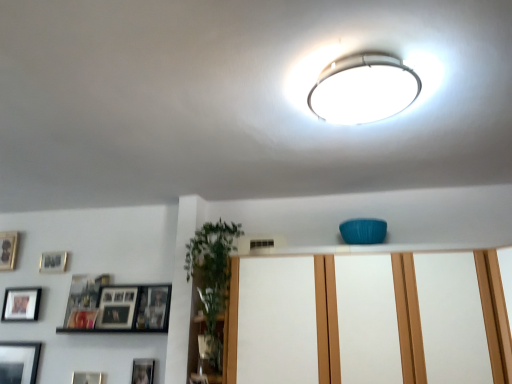
What is the approximate height of wooden photo frame at left, which ranks as the sixth picture frame in right-to-left order?

The height of wooden photo frame at left, which ranks as the sixth picture frame in right-to-left order, is 22.86 centimeters.

What do you see at coordinates (53, 262) in the screenshot?
I see `matte silver picture frame at upper left, the fifth picture frame positioned from the bottom` at bounding box center [53, 262].

Measure the distance between point (430, 313) and camera.

Point (430, 313) and camera are 5.21 feet apart from each other.

You are a GUI agent. You are given a task and a screenshot of the screen. Output one action in this format:
    pyautogui.click(x=<x>, y=<y>)
    Task: Click on the matte black picture frame at lower left, which appears as the second picture frame when viewed from the left
    This screenshot has width=512, height=384.
    Given the screenshot: What is the action you would take?
    pyautogui.click(x=21, y=304)

What is the approximate width of wooden photo frame at lower center, which is the first picture frame in right-to-left order?

wooden photo frame at lower center, which is the first picture frame in right-to-left order, is 1.82 centimeters wide.

Describe the element at coordinates (83, 300) in the screenshot. I see `matte black picture frame at upper left, which is the 3th picture frame in top-to-bottom order` at that location.

Identify the location of wooden photo frame at left, placed as the 1th picture frame when sorted from left to right. This screenshot has width=512, height=384. (8, 250).

In the image, is wooden photo frame at lower center, arranged as the sixth picture frame when viewed from the left, on the left side or the right side of matte white dresser at center?

Clearly, wooden photo frame at lower center, arranged as the sixth picture frame when viewed from the left, is on the left of matte white dresser at center in the image.

Who is smaller, wooden photo frame at lower center, arranged as the sixth picture frame when viewed from the left, or matte white dresser at center?

wooden photo frame at lower center, arranged as the sixth picture frame when viewed from the left, is smaller.

Does point (139, 373) appear closer or farther from the camera than point (357, 307)?

Clearly, point (139, 373) is more distant from the camera than point (357, 307).

Is matte black picture frame at lower left, which is counted as the fifth picture frame, starting from the right, turned away from matte silver picture frame at upper left, the fifth picture frame positioned from the bottom?

No.

Considering the relative positions of matte black picture frame at lower left, which appears as the second picture frame when viewed from the left, and matte silver picture frame at upper left, the fourth picture frame positioned from the right, in the image provided, is matte black picture frame at lower left, which appears as the second picture frame when viewed from the left, behind matte silver picture frame at upper left, the fourth picture frame positioned from the right,?

No, the depth of matte black picture frame at lower left, which appears as the second picture frame when viewed from the left, is less than that of matte silver picture frame at upper left, the fourth picture frame positioned from the right.

Identify the location of picture frame that is the 1st one when counting rightward from the matte black picture frame at lower left, which is the 4th picture frame in top-to-bottom order. This screenshot has height=384, width=512. (53, 262).

From a real-world perspective, is matte white dresser at center physically below white glossy ceiling light at upper center?

Yes.

Considering the sizes of matte white dresser at center and white glossy ceiling light at upper center in the image, is matte white dresser at center wider or thinner than white glossy ceiling light at upper center?

In the image, matte white dresser at center appears to be wider than white glossy ceiling light at upper center.

Measure the distance between matte white dresser at center and white glossy ceiling light at upper center.

matte white dresser at center is 32.53 inches from white glossy ceiling light at upper center.

Is matte white dresser at center shorter than white glossy ceiling light at upper center?

Incorrect, the height of matte white dresser at center does not fall short of that of white glossy ceiling light at upper center.

Is matte white dresser at center wider than matte black picture frame at lower left, the 3th picture frame positioned from the bottom?

Yes.

Looking at this image, can you see matte white dresser at center touching matte black picture frame at lower left, the 3th picture frame positioned from the bottom?

No.

Does point (229, 354) lie behind point (20, 311)?

No, (229, 354) is closer to viewer.

Is white glossy ceiling light at upper center facing away from wooden photo frame at left, positioned as the 1th picture frame in top-to-bottom order?

No, white glossy ceiling light at upper center is not facing the opposite direction of wooden photo frame at left, positioned as the 1th picture frame in top-to-bottom order.

Consider the image. Does white glossy ceiling light at upper center contain wooden photo frame at left, placed as the 1th picture frame when sorted from left to right?

No, wooden photo frame at left, placed as the 1th picture frame when sorted from left to right, is not a part of white glossy ceiling light at upper center.

Is white glossy ceiling light at upper center further to camera compared to wooden photo frame at left, which ranks as the sixth picture frame in right-to-left order?

No, white glossy ceiling light at upper center is closer to the viewer.

In terms of height, does white glossy ceiling light at upper center look taller or shorter compared to wooden photo frame at left, placed as the 1th picture frame when sorted from left to right?

Considering their sizes, white glossy ceiling light at upper center has less height than wooden photo frame at left, placed as the 1th picture frame when sorted from left to right.

Is point (42, 271) positioned after point (400, 329)?

Yes.

From a real-world perspective, which is physically below, matte silver picture frame at upper left, the fourth picture frame positioned from the right, or matte white dresser at center?

matte white dresser at center is physically lower.

What's the angular difference between matte silver picture frame at upper left, which ranks as the 2th picture frame in top-to-bottom order, and matte white dresser at center's facing directions?

They differ by 0.427 degrees in their facing directions.

Is matte white dresser at center at the back of matte silver picture frame at upper left, the fifth picture frame positioned from the bottom?

No, matte silver picture frame at upper left, the fifth picture frame positioned from the bottom, is not facing away from matte white dresser at center.

What's the angular difference between matte silver picture frame at upper left, placed as the 3th picture frame when sorted from left to right, and matte black picture frame at lower left, the 3th picture frame positioned from the bottom,'s facing directions?

The angle between the facing direction of matte silver picture frame at upper left, placed as the 3th picture frame when sorted from left to right, and the facing direction of matte black picture frame at lower left, the 3th picture frame positioned from the bottom, is 0.00536 degrees.

Can we say matte silver picture frame at upper left, placed as the 3th picture frame when sorted from left to right, lies outside matte black picture frame at lower left, which is the 4th picture frame in top-to-bottom order?

Yes.

How far apart are matte silver picture frame at upper left, the fourth picture frame positioned from the right, and matte black picture frame at lower left, which is the 4th picture frame in top-to-bottom order?

They are 19.06 centimeters apart.

Considering the sizes of matte silver picture frame at upper left, placed as the 3th picture frame when sorted from left to right, and matte black picture frame at lower left, which appears as the second picture frame when viewed from the left, in the image, is matte silver picture frame at upper left, placed as the 3th picture frame when sorted from left to right, bigger or smaller than matte black picture frame at lower left, which appears as the second picture frame when viewed from the left,?

Clearly, matte silver picture frame at upper left, placed as the 3th picture frame when sorted from left to right, is smaller in size than matte black picture frame at lower left, which appears as the second picture frame when viewed from the left.

Identify the location of the 1st picture frame behind the matte white dresser at center, starting your count from the anchor. The width and height of the screenshot is (512, 384). (143, 371).

From a real-world perspective, starting from the matte black picture frame at lower left, which is the 4th picture frame in top-to-bottom order, which picture frame is the 2nd one vertically above it? Please provide its 2D coordinates.

[(53, 262)]

Looking at this image, estimate the real-world distances between objects in this image. Which object is closer to matte black picture frame at lower left, positioned as the 6th picture frame in top-to-bottom order, matte black picture frame at upper left, the third picture frame viewed from the right, or wooden photo frame at left, the 6th picture frame ordered from the bottom?

matte black picture frame at upper left, the third picture frame viewed from the right, is positioned closer to the anchor matte black picture frame at lower left, positioned as the 6th picture frame in top-to-bottom order.

Based on their spatial positions, is matte silver picture frame at upper left, the fourth picture frame positioned from the right, or matte black picture frame at lower left, which is counted as the fifth picture frame, starting from the right, further from wooden photo frame at lower center, which is counted as the 2th picture frame, starting from the bottom?

matte silver picture frame at upper left, the fourth picture frame positioned from the right.

When comparing their distances from matte white dresser at center, does matte silver picture frame at upper left, placed as the 3th picture frame when sorted from left to right, or matte black picture frame at lower left, which is counted as the fifth picture frame, starting from the right, seem closer?

Among the two, matte silver picture frame at upper left, placed as the 3th picture frame when sorted from left to right, is located nearer to matte white dresser at center.

Which object lies nearer to the anchor point matte white dresser at center, matte silver picture frame at upper left, the fourth picture frame positioned from the right, or wooden photo frame at lower center, arranged as the sixth picture frame when viewed from the left?

The object closer to matte white dresser at center is wooden photo frame at lower center, arranged as the sixth picture frame when viewed from the left.

Based on their spatial positions, is matte white dresser at center or matte black picture frame at upper left, which is the 3th picture frame in top-to-bottom order, further from matte silver picture frame at upper left, the fifth picture frame positioned from the bottom?

matte white dresser at center is further to matte silver picture frame at upper left, the fifth picture frame positioned from the bottom.

Based on their spatial positions, is matte white dresser at center or matte black picture frame at lower left, which appears as the second picture frame when viewed from the left, further from wooden photo frame at lower center, arranged as the sixth picture frame when viewed from the left?

matte white dresser at center lies further to wooden photo frame at lower center, arranged as the sixth picture frame when viewed from the left, than the other object.

Looking at the image, which one is located closer to matte black picture frame at lower left, which appears as the second picture frame when viewed from the left, matte silver picture frame at upper left, which ranks as the 2th picture frame in top-to-bottom order, or matte white dresser at center?

matte silver picture frame at upper left, which ranks as the 2th picture frame in top-to-bottom order.

From the image, which object appears to be farther from matte black picture frame at upper left, the third picture frame viewed from the right, matte black picture frame at lower left, which is counted as the fifth picture frame, starting from the right, or wooden photo frame at lower center, which is the first picture frame in right-to-left order?

Based on the image, wooden photo frame at lower center, which is the first picture frame in right-to-left order, appears to be further to matte black picture frame at upper left, the third picture frame viewed from the right.

This screenshot has width=512, height=384. I want to click on dresser situated between matte silver picture frame at upper left, placed as the 3th picture frame when sorted from left to right, and white glossy ceiling light at upper center from left to right, so click(368, 319).

In order to click on picture frame between matte black picture frame at lower left, which is counted as the fifth picture frame, starting from the right, and matte black picture frame at upper left, which ranks as the fourth picture frame in left-to-right order, in the horizontal direction in this screenshot , I will do `click(53, 262)`.

What are the coordinates of `dresser situated between wooden photo frame at left, which ranks as the sixth picture frame in right-to-left order, and white glossy ceiling light at upper center from left to right` in the screenshot? It's located at (368, 319).

Locate an element on the screen. The image size is (512, 384). picture frame between matte black picture frame at lower left, which appears as the 2th picture frame when viewed from the right, and matte white dresser at center from left to right is located at coordinates (143, 371).